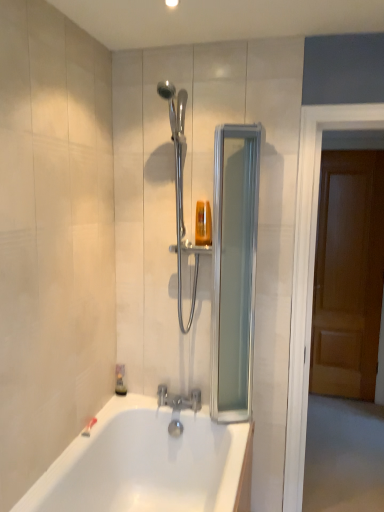
How much space does wooden door at right, arranged as the 1th screen door when viewed from the right, occupy vertically?

The height of wooden door at right, arranged as the 1th screen door when viewed from the right, is 6.80 feet.

The width and height of the screenshot is (384, 512). What do you see at coordinates (348, 274) in the screenshot?
I see `brown wooden door at right` at bounding box center [348, 274].

The image size is (384, 512). What do you see at coordinates (178, 406) in the screenshot?
I see `silver metallic faucet at lower center` at bounding box center [178, 406].

Image resolution: width=384 pixels, height=512 pixels. I want to click on clear glass screen door at upper center, which ranks as the 1th screen door in left-to-right order, so click(234, 270).

Where is `polished chrome shower head at upper center`? polished chrome shower head at upper center is located at coordinates (179, 187).

Is wooden door at right, arranged as the 1th screen door when viewed from the right, thinner than translucent plastic soap dispenser at lower left?

Incorrect, the width of wooden door at right, arranged as the 1th screen door when viewed from the right, is not less than that of translucent plastic soap dispenser at lower left.

The height and width of the screenshot is (512, 384). In the image, there is a wooden door at right, arranged as the 1th screen door when viewed from the right. Identify the location of soap dispenser below it (from a real-world perspective). pos(120,380).

Considering the sizes of objects wooden door at right, the second screen door in the left-to-right sequence, and translucent plastic soap dispenser at lower left in the image provided, who is bigger, wooden door at right, the second screen door in the left-to-right sequence, or translucent plastic soap dispenser at lower left?

Bigger between the two is wooden door at right, the second screen door in the left-to-right sequence.

Between translucent plastic soap dispenser at upper center and silver metallic faucet at lower center, which one has smaller size?

With smaller size is translucent plastic soap dispenser at upper center.

Based on the photo, from the image's perspective, would you say translucent plastic soap dispenser at upper center is shown under silver metallic faucet at lower center?

Actually, translucent plastic soap dispenser at upper center appears above silver metallic faucet at lower center in the image.

Find the location of a particular element. This screenshot has width=384, height=512. tap below the translucent plastic soap dispenser at upper center (from a real-world perspective) is located at coordinates (178, 406).

Would you say translucent plastic soap dispenser at upper center is a long distance from silver metallic faucet at lower center?

No, translucent plastic soap dispenser at upper center is in close proximity to silver metallic faucet at lower center.

From the picture: Is brown wooden door at right completely or partially inside wooden door at right, the second screen door in the left-to-right sequence?

No, brown wooden door at right is located outside of wooden door at right, the second screen door in the left-to-right sequence.

From the image's perspective, which one is positioned higher, wooden door at right, arranged as the 1th screen door when viewed from the right, or brown wooden door at right?

brown wooden door at right.

Is wooden door at right, arranged as the 1th screen door when viewed from the right, next to brown wooden door at right and touching it?

There is a gap between wooden door at right, arranged as the 1th screen door when viewed from the right, and brown wooden door at right.

Which is more to the right, clear glass screen door at upper center, which ranks as the 1th screen door in left-to-right order, or brown wooden door at right?

From the viewer's perspective, brown wooden door at right appears more on the right side.

Is clear glass screen door at upper center, which ranks as the 1th screen door in left-to-right order, positioned beyond the bounds of brown wooden door at right?

Absolutely, clear glass screen door at upper center, which ranks as the 1th screen door in left-to-right order, is external to brown wooden door at right.

Is clear glass screen door at upper center, which ranks as the 1th screen door in left-to-right order, next to brown wooden door at right?

clear glass screen door at upper center, which ranks as the 1th screen door in left-to-right order, is not next to brown wooden door at right, and they're not touching.

In the scene shown: Is brown wooden door at right wider than wooden door at right, the second screen door in the left-to-right sequence?

Incorrect, the width of brown wooden door at right does not surpass that of wooden door at right, the second screen door in the left-to-right sequence.

From the image's perspective, is brown wooden door at right below wooden door at right, arranged as the 1th screen door when viewed from the right?

No, from the image's perspective, brown wooden door at right is not below wooden door at right, arranged as the 1th screen door when viewed from the right.

How different are the orientations of brown wooden door at right and wooden door at right, the second screen door in the left-to-right sequence, in degrees?

There is a 0.626-degree angle between the facing directions of brown wooden door at right and wooden door at right, the second screen door in the left-to-right sequence.

Who is smaller, brown wooden door at right or wooden door at right, the second screen door in the left-to-right sequence?

brown wooden door at right.

In the scene shown: From the image's perspective, is silver metallic faucet at lower center positioned above or below wooden door at right, the second screen door in the left-to-right sequence?

silver metallic faucet at lower center is below wooden door at right, the second screen door in the left-to-right sequence.

From a real-world perspective, is silver metallic faucet at lower center above or below wooden door at right, the second screen door in the left-to-right sequence?

Clearly, from a real-world perspective, silver metallic faucet at lower center is below wooden door at right, the second screen door in the left-to-right sequence.

Between silver metallic faucet at lower center and wooden door at right, arranged as the 1th screen door when viewed from the right, which one appears on the left side from the viewer's perspective?

silver metallic faucet at lower center is more to the left.

Which of these two, silver metallic faucet at lower center or wooden door at right, arranged as the 1th screen door when viewed from the right, stands taller?

wooden door at right, arranged as the 1th screen door when viewed from the right, is taller.

Can you tell me how much wooden door at right, the second screen door in the left-to-right sequence, and polished chrome shower head at upper center differ in facing direction?

1.08 degrees.

Is wooden door at right, the second screen door in the left-to-right sequence, inside or outside of polished chrome shower head at upper center?

wooden door at right, the second screen door in the left-to-right sequence, cannot be found inside polished chrome shower head at upper center.

Consider the image. Between wooden door at right, the second screen door in the left-to-right sequence, and polished chrome shower head at upper center, which one has smaller size?

With smaller size is polished chrome shower head at upper center.

From the image's perspective, starting from the translucent plastic soap dispenser at lower left, which screen door is the 1st one above? Please provide its 2D coordinates.

[(310, 274)]

This screenshot has height=512, width=384. What are the coordinates of `tap behind the translucent plastic soap dispenser at upper center` in the screenshot? It's located at (178, 406).

Estimate the real-world distances between objects in this image. Which object is further from brown wooden door at right, silver metallic faucet at lower center or wooden door at right, the second screen door in the left-to-right sequence?

silver metallic faucet at lower center is further to brown wooden door at right.

Based on the photo, which object lies nearer to the anchor point polished chrome shower head at upper center, translucent plastic soap dispenser at upper center or silver metallic faucet at lower center?

Based on the image, translucent plastic soap dispenser at upper center appears to be nearer to polished chrome shower head at upper center.

Based on the photo, which object lies nearer to the anchor point translucent plastic soap dispenser at upper center, silver metallic faucet at lower center or translucent plastic soap dispenser at lower left?

translucent plastic soap dispenser at lower left is positioned closer to the anchor translucent plastic soap dispenser at upper center.

Estimate the real-world distances between objects in this image. Which object is closer to translucent plastic soap dispenser at lower left, translucent plastic soap dispenser at upper center or silver metallic faucet at lower center?

silver metallic faucet at lower center is positioned closer to the anchor translucent plastic soap dispenser at lower left.

Looking at the image, which one is located further to polished chrome shower head at upper center, silver metallic faucet at lower center or translucent plastic soap dispenser at upper center?

The object further to polished chrome shower head at upper center is silver metallic faucet at lower center.

From the image, which object appears to be nearer to clear glass screen door at upper center, which ranks as the 1th screen door in left-to-right order, polished chrome shower head at upper center or brown wooden door at right?

polished chrome shower head at upper center.

From the image, which object appears to be farther from wooden door at right, the second screen door in the left-to-right sequence, polished chrome shower head at upper center or silver metallic faucet at lower center?

silver metallic faucet at lower center is positioned further to the anchor wooden door at right, the second screen door in the left-to-right sequence.

Based on their spatial positions, is brown wooden door at right or polished chrome shower head at upper center closer to wooden door at right, the second screen door in the left-to-right sequence?

The object closer to wooden door at right, the second screen door in the left-to-right sequence, is polished chrome shower head at upper center.

Find the location of a particular element. screen door between polished chrome shower head at upper center and wooden door at right, the second screen door in the left-to-right sequence is located at coordinates (234, 270).

Locate an element on the screen. The height and width of the screenshot is (512, 384). toiletry that lies between polished chrome shower head at upper center and translucent plastic soap dispenser at lower left from top to bottom is located at coordinates (203, 224).

The height and width of the screenshot is (512, 384). In order to click on soap dispenser between polished chrome shower head at upper center and silver metallic faucet at lower center from top to bottom in this screenshot , I will do `click(120, 380)`.

This screenshot has width=384, height=512. What are the coordinates of `tap between translucent plastic soap dispenser at lower left and brown wooden door at right in the horizontal direction` in the screenshot? It's located at (178, 406).